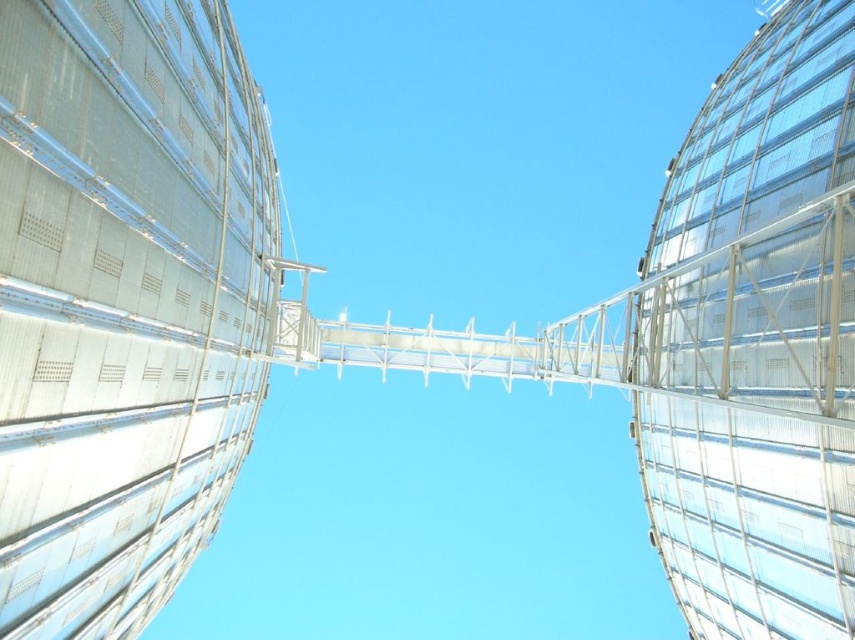
Question: Can you confirm if metallic silver tower at left is positioned below transparent glass tower at right?

Choices:
 (A) yes
 (B) no

Answer: (A)

Question: Which point is closer to the camera?

Choices:
 (A) transparent glass tower at right
 (B) metallic silver tower at left

Answer: (B)

Question: Does metallic silver tower at left have a smaller size compared to transparent glass tower at right?

Choices:
 (A) no
 (B) yes

Answer: (B)

Question: Which of the following is the farthest from the observer?

Choices:
 (A) transparent glass tower at right
 (B) metallic silver tower at left

Answer: (A)

Question: Which point is farther to the camera?

Choices:
 (A) (91, 1)
 (B) (770, 248)

Answer: (B)

Question: Can you confirm if metallic silver tower at left is positioned to the right of transparent glass tower at right?

Choices:
 (A) no
 (B) yes

Answer: (A)